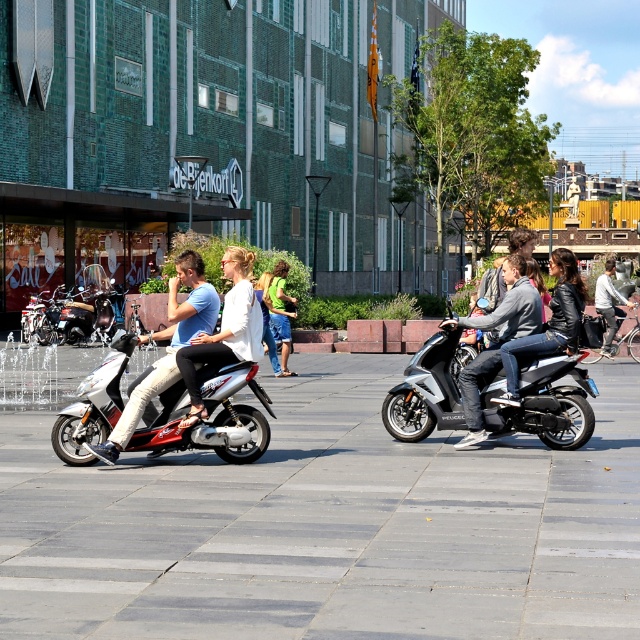
You are a delivery person who needs to load a package onto the silver metallic scooter at center. The package requires at least 10 cm of clearance above it to avoid hitting the denim jacket at center. Is there enough vertical space between the scooter and the jacket?

The silver metallic scooter at center is not as tall as the denim jacket at center, meaning there is sufficient vertical space between them. Therefore, the package should fit without hitting the jacket.

You are standing in the plaza and want to walk to the gray concrete pavement at center from the silver metallic scooter at center. Which direction should you move in?

The gray concrete pavement at center is to the left of the silver metallic scooter at center, so you should move to the left to reach it.